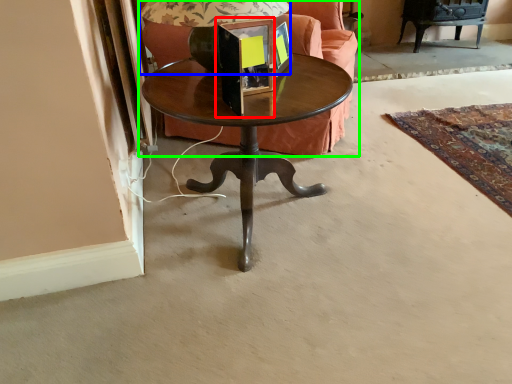
Question: Which object is positioned farthest from picture frame (highlighted by a red box)? Select from table lamp (highlighted by a blue box) and studio couch (highlighted by a green box).

Choices:
 (A) table lamp
 (B) studio couch

Answer: (B)